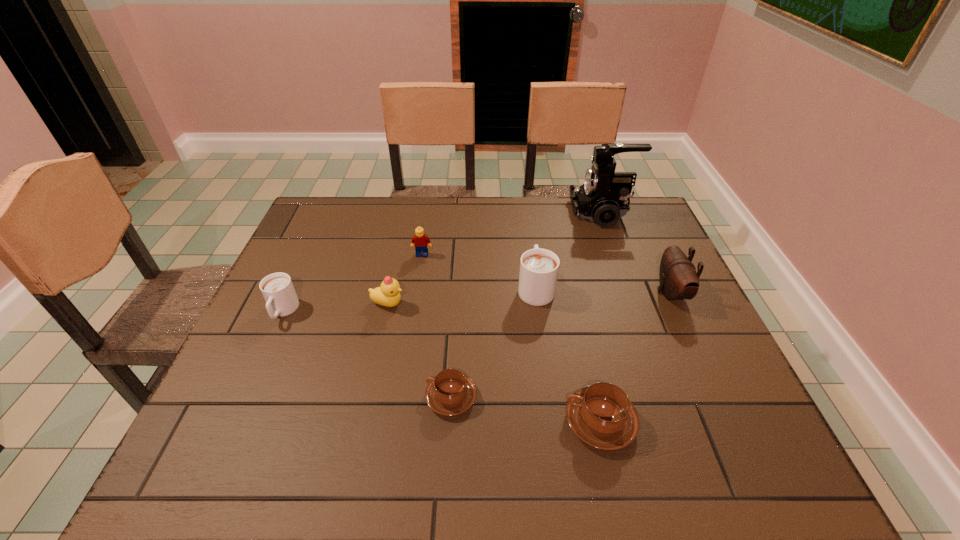
Where is `free space that is in between the left white cappuccino and the Lego`? The image size is (960, 540). free space that is in between the left white cappuccino and the Lego is located at coordinates (352, 283).

You are a GUI agent. You are given a task and a screenshot of the screen. Output one action in this format:
    pyautogui.click(x=<x>, y=<y>)
    Task: Click on the sixth closest object to the left white cappuccino
    The width and height of the screenshot is (960, 540).
    Given the screenshot: What is the action you would take?
    pyautogui.click(x=603, y=197)

Identify which object is the fourth closest to the yellow duckling. Please provide its 2D coordinates. Your answer should be formatted as a tuple, i.e. [(x, y)], where the tuple contains the x and y coordinates of a point satisfying the conditions above.

[(539, 268)]

Select which cappuccino appears as the closest to the leftmost object. Please provide its 2D coordinates. Your answer should be formatted as a tuple, i.e. [(x, y)], where the tuple contains the x and y coordinates of a point satisfying the conditions above.

[(450, 393)]

Image resolution: width=960 pixels, height=540 pixels. Find the location of `cappuccino that can be found as the closest to the shortest cappuccino`. cappuccino that can be found as the closest to the shortest cappuccino is located at coordinates (601, 415).

The height and width of the screenshot is (540, 960). What are the coordinates of `free spot that satisfies the following two spatial constraints: 1. on the front-facing side of the yellow duckling; 2. on the side with the handle of the leftmost object` in the screenshot? It's located at (387, 312).

In order to click on blank area in the image that satisfies the following two spatial constraints: 1. on the lens mount of the camcorder; 2. on the side with the handle of the left white cappuccino in this screenshot , I will do `click(638, 312)`.